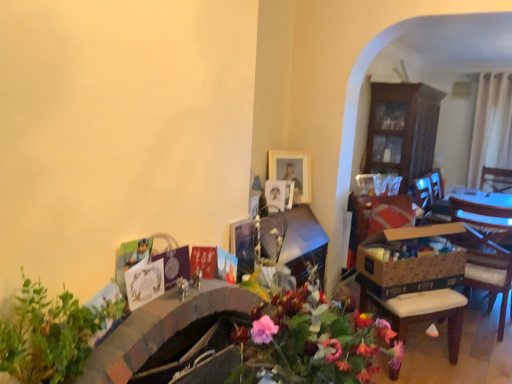
The width and height of the screenshot is (512, 384). I want to click on green leafy plant at lower left, so click(49, 334).

Describe the element at coordinates (485, 220) in the screenshot. Image resolution: width=512 pixels, height=384 pixels. I see `wooden chair at right` at that location.

You are a GUI agent. You are given a task and a screenshot of the screen. Output one action in this format:
    pyautogui.click(x=<x>, y=<y>)
    Task: Click on the brown cardboard box at right
    The width and height of the screenshot is (512, 384).
    Given the screenshot: What is the action you would take?
    pyautogui.click(x=410, y=267)

Between wooden cabinet at right and brown cardboard box at right, which one appears on the right side from the viewer's perspective?

wooden cabinet at right is more to the right.

Where is `cabinetry behind the brown cardboard box at right`? cabinetry behind the brown cardboard box at right is located at coordinates (402, 130).

Could you tell me if wooden cabinet at right is turned towards brown cardboard box at right?

No, wooden cabinet at right does not turn towards brown cardboard box at right.

Which object is positioned more to the right, wooden cabinet at right or wooden picture frame at upper center?

From the viewer's perspective, wooden cabinet at right appears more on the right side.

How different are the orientations of wooden cabinet at right and wooden picture frame at upper center in degrees?

They differ by 39.2 degrees in their facing directions.

From the picture: Which of these two, wooden cabinet at right or wooden picture frame at upper center, is thinner?

wooden picture frame at upper center.

Considering the sizes of wooden cabinet at right and wooden picture frame at upper center in the image, is wooden cabinet at right bigger or smaller than wooden picture frame at upper center?

Considering their sizes, wooden cabinet at right takes up more space than wooden picture frame at upper center.

How different are the orientations of green leafy plant at lower left and wooden chair at right in degrees?

There is a 95-degree angle between the facing directions of green leafy plant at lower left and wooden chair at right.

Which object is positioned more to the right, green leafy plant at lower left or wooden chair at right?

From the viewer's perspective, wooden chair at right appears more on the right side.

Is green leafy plant at lower left aimed at wooden chair at right?

No, green leafy plant at lower left is not facing towards wooden chair at right.

Considering the sizes of green leafy plant at lower left and wooden chair at right in the image, is green leafy plant at lower left taller or shorter than wooden chair at right?

green leafy plant at lower left is shorter than wooden chair at right.

Is wooden chair at right positioned behind wooden picture frame at upper center?

Yes.

Could you tell me if wooden chair at right is facing wooden picture frame at upper center?

Yes, wooden chair at right is turned towards wooden picture frame at upper center.

Considering the positions of objects wooden chair at right and wooden picture frame at upper center in the image provided, who is more to the right, wooden chair at right or wooden picture frame at upper center?

wooden chair at right is more to the right.

Is point (509, 227) positioned in front of point (282, 161)?

No, it is not.

Is point (452, 203) closer to viewer compared to point (408, 282)?

No, (452, 203) is further to viewer.

What are the coordinates of `flower basket that appears on the left of wooden chair at right` in the screenshot? It's located at (410, 267).

Between wooden chair at right and brown cardboard box at right, which one has smaller width?

brown cardboard box at right.

Considering the sizes of objects wooden chair at right and brown cardboard box at right in the image provided, who is shorter, wooden chair at right or brown cardboard box at right?

brown cardboard box at right is shorter.

Does point (390, 154) lie behind point (484, 210)?

That is True.

Is wooden cabinet at right turned away from wooden chair at right?

No, wooden cabinet at right's orientation is not away from wooden chair at right.

Does wooden cabinet at right lie behind wooden chair at right?

No, it is not.

Can you confirm if wooden cabinet at right is bigger than wooden chair at right?

Yes, wooden cabinet at right is bigger than wooden chair at right.

Based on the photo, is wooden chair at right shorter than wooden cabinet at right?

Yes, wooden chair at right is shorter than wooden cabinet at right.

Considering the relative sizes of wooden chair at right and wooden cabinet at right in the image provided, is wooden chair at right thinner than wooden cabinet at right?

No.

Which object is positioned more to the left, wooden chair at right or wooden cabinet at right?

wooden cabinet at right.

From a real-world perspective, is wooden chair at right physically above wooden cabinet at right?

No, from a real-world perspective, wooden chair at right is not above wooden cabinet at right.

At what (x,y) coordinates should I click in order to perform the action: click on cabinetry on the right of brown cardboard box at right. Please return your answer as a coordinate pair (x, y). This screenshot has height=384, width=512. Looking at the image, I should click on (402, 130).

The height and width of the screenshot is (384, 512). I want to click on picture frame in front of the wooden cabinet at right, so click(292, 172).

Considering their positions, is green leafy plant at lower left positioned further to brown cardboard box at right than wooden picture frame at upper center?

The object further to brown cardboard box at right is green leafy plant at lower left.

From the image, which object appears to be farther from wooden cabinet at right, wooden chair at right or green leafy plant at lower left?

Based on the image, green leafy plant at lower left appears to be further to wooden cabinet at right.

When comparing their distances from green leafy plant at lower left, does wooden picture frame at upper center or brown cardboard box at right seem further?

brown cardboard box at right.

In the scene shown: From the image, which object appears to be farther from wooden chair at right, green leafy plant at lower left or wooden picture frame at upper center?

green leafy plant at lower left.

Based on their spatial positions, is wooden picture frame at upper center or wooden cabinet at right closer to wooden chair at right?

The object closer to wooden chair at right is wooden cabinet at right.

Looking at the image, which one is located closer to green leafy plant at lower left, wooden cabinet at right or brown cardboard box at right?

The object closer to green leafy plant at lower left is brown cardboard box at right.

Which object lies nearer to the anchor point wooden chair at right, green leafy plant at lower left or brown cardboard box at right?

Among the two, brown cardboard box at right is located nearer to wooden chair at right.

Considering their positions, is wooden cabinet at right positioned further to wooden chair at right than green leafy plant at lower left?

green leafy plant at lower left is further to wooden chair at right.

This screenshot has width=512, height=384. Identify the location of cabinetry located between wooden picture frame at upper center and wooden chair at right in the left-right direction. (402, 130).

The width and height of the screenshot is (512, 384). I want to click on flower basket between green leafy plant at lower left and wooden chair at right along the z-axis, so click(x=410, y=267).

The width and height of the screenshot is (512, 384). In order to click on cabinetry located between brown cardboard box at right and wooden chair at right in the depth direction in this screenshot , I will do `click(402, 130)`.

The height and width of the screenshot is (384, 512). I want to click on flower basket between wooden picture frame at upper center and wooden cabinet at right in the horizontal direction, so [x=410, y=267].